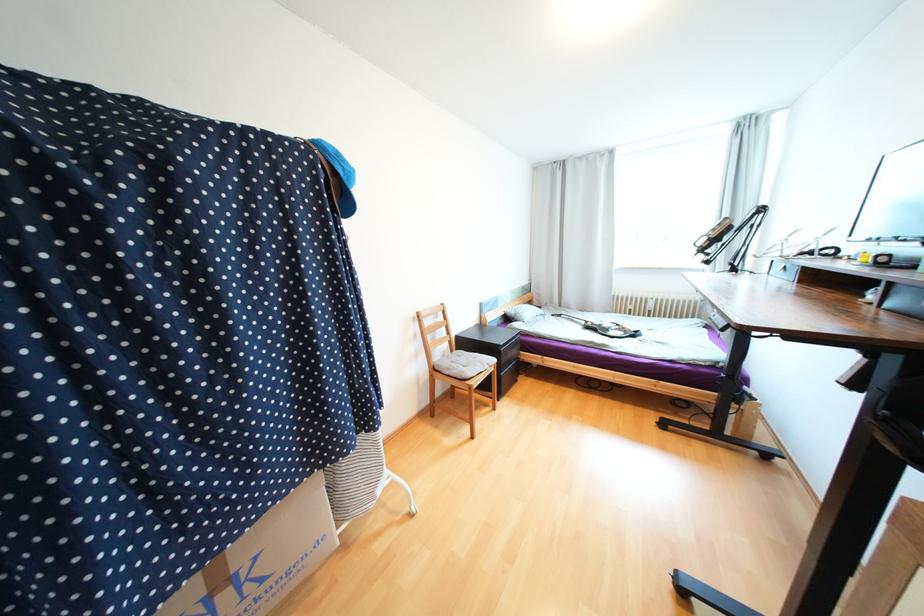
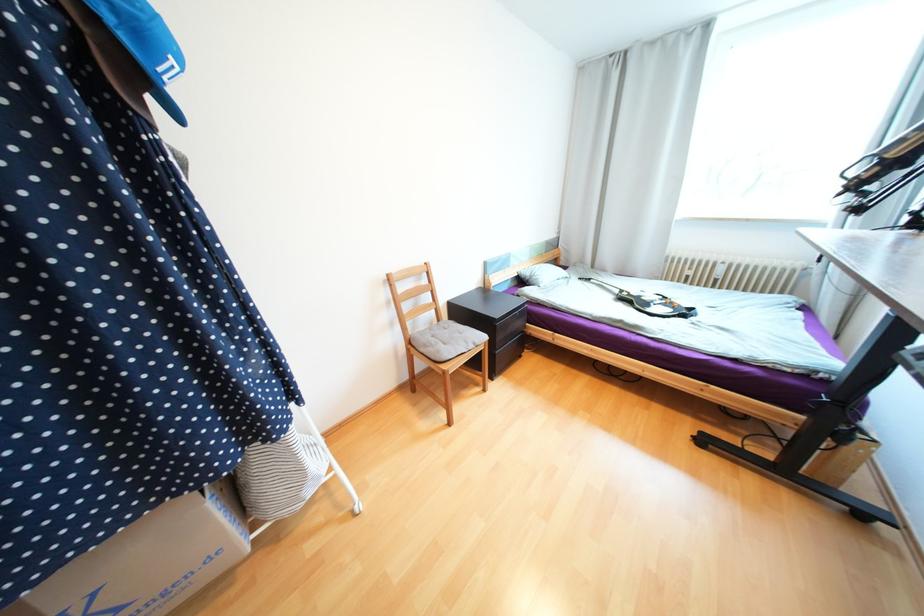
In the second image, find the point that corresponds to point (590, 323) in the first image.

(623, 292)